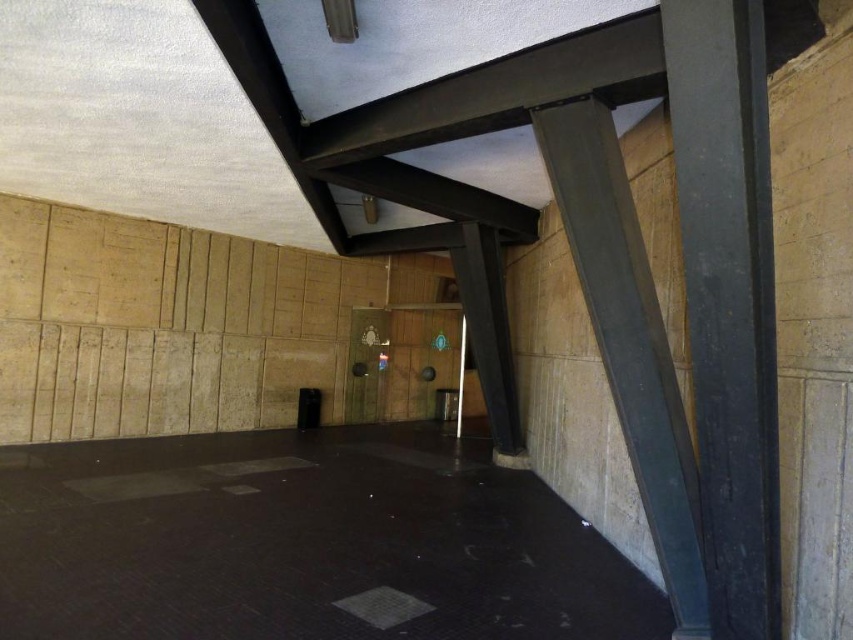
You are standing in the corridor and want to determine which of the two points, point (x=715, y=445) or point (x=578, y=109), is nearer to you. Based on the scene description, which point is closer?

Point (x=715, y=445) is closer to the camera than point (x=578, y=109), so it is the nearer one.

You are a delivery person carrying a large package that requires a clear path of 12 feet to maneuver. You see the black concrete floor at lower left. Can you safely navigate through the corridor while maintaining the required clearance?

The distance between the black concrete floor at lower left and the other objects is 13.36 feet, which is more than the required 12 feet clearance. Therefore, you can safely navigate through the corridor while maintaining the required clearance.

You are a maintenance worker needing to reach the metallic gray beam at center for repairs. You are currently standing on the black concrete floor at lower left. Which direction should you move to get closer to the beam?

You should move forward because the black concrete floor at lower left is further to the viewer than the metallic gray beam at center, meaning the beam is closer to you than the floor you are standing on.